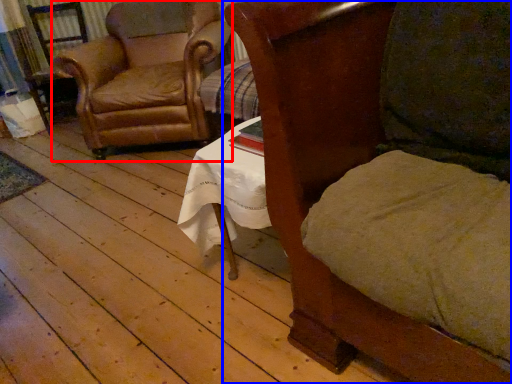
Question: Which object appears farthest to the camera in this image, chair (highlighted by a red box) or chair (highlighted by a blue box)?

Choices:
 (A) chair
 (B) chair

Answer: (A)